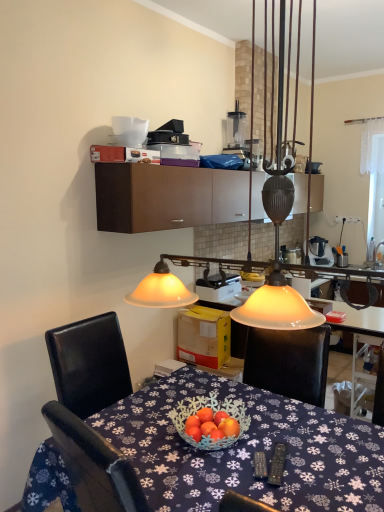
Question: Considering the relative positions of white plastic toaster at center, which appears as the 2th appliance when viewed from the right, and blue fabric tablecloth at center in the image provided, is white plastic toaster at center, which appears as the 2th appliance when viewed from the right, to the left or to the right of blue fabric tablecloth at center?

Choices:
 (A) right
 (B) left

Answer: (A)

Question: From the image's perspective, is white plastic toaster at center, which appears as the first appliance when ordered from the bottom, located above or below blue fabric tablecloth at center?

Choices:
 (A) below
 (B) above

Answer: (B)

Question: Which object is positioned farthest from the white plastic blender at upper center, which appears as the second appliance when viewed from the front?

Choices:
 (A) blue fabric tablecloth at center
 (B) matte glass lampshade at upper center
 (C) brown matte cabinet at upper center
 (D) white plastic toaster at center, the first appliance when ordered from left to right

Answer: (B)

Question: Which of these objects is positioned farthest from the white plastic toaster at center, placed as the 2th appliance when sorted from back to front?

Choices:
 (A) brown matte cabinet at upper center
 (B) white plastic blender at upper center, which appears as the second appliance when viewed from the left
 (C) blue fabric tablecloth at center
 (D) matte glass lampshade at upper center

Answer: (B)